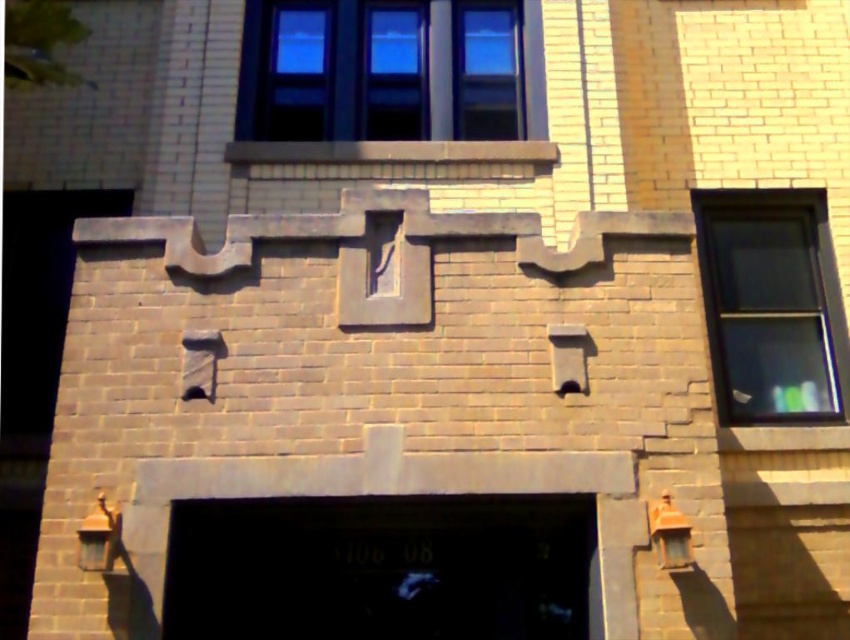
Question: Is clear glass window at upper center closer to the viewer compared to clear glass window at right?

Choices:
 (A) no
 (B) yes

Answer: (A)

Question: Which of the following is the closest to the observer?

Choices:
 (A) clear glass window at upper center
 (B) clear glass window at right
 (C) black glass door at center

Answer: (C)

Question: Which point is closer to the camera?

Choices:
 (A) black glass door at center
 (B) clear glass window at right
 (C) clear glass window at upper center

Answer: (A)

Question: Does clear glass window at upper center come behind clear glass window at right?

Choices:
 (A) yes
 (B) no

Answer: (A)

Question: Among these points, which one is farthest from the camera?

Choices:
 (A) (565, 593)
 (B) (445, 70)
 (C) (799, 394)

Answer: (B)

Question: Does black glass door at center appear on the right side of clear glass window at upper center?

Choices:
 (A) yes
 (B) no

Answer: (A)